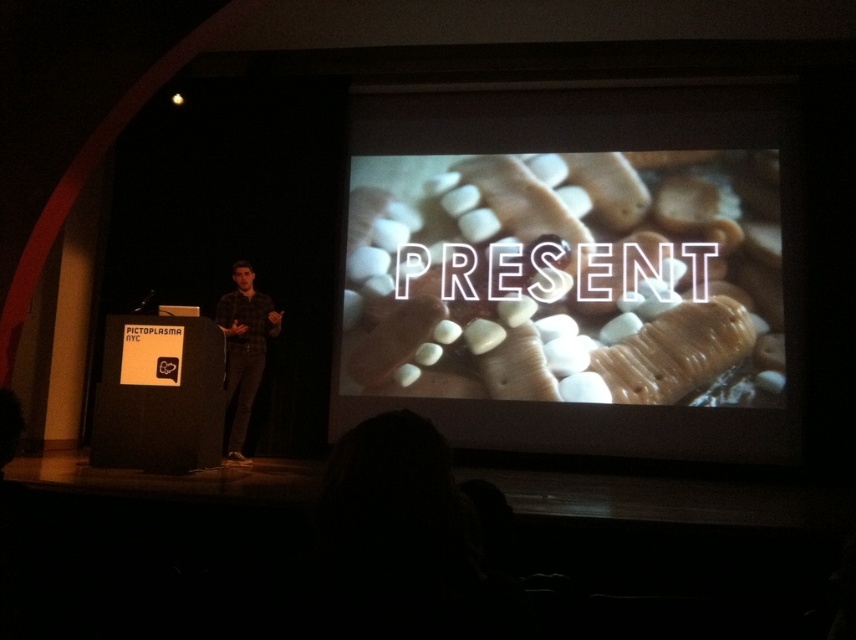
Between white matte marshmallows at center and plaid shirt at center, which one appears on the left side from the viewer's perspective?

plaid shirt at center is more to the left.

In the scene shown: Can you confirm if white matte marshmallows at center is taller than plaid shirt at center?

Correct, white matte marshmallows at center is much taller as plaid shirt at center.

Is point (654, 266) farther from camera compared to point (281, 310)?

Yes.

This screenshot has height=640, width=856. I want to click on white matte marshmallows at center, so click(x=577, y=269).